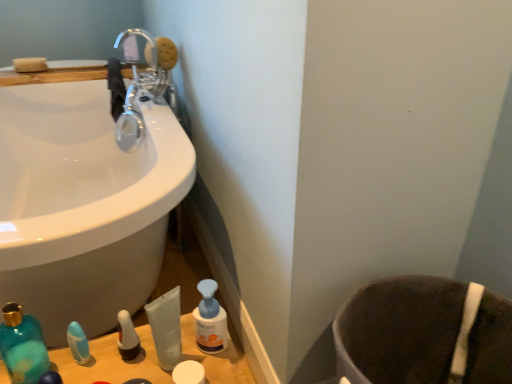
Find the location of a particular element. This screenshot has width=512, height=384. empty space that is ontop of matte plastic bottles at lower left (from a real-world perspective) is located at coordinates (128, 357).